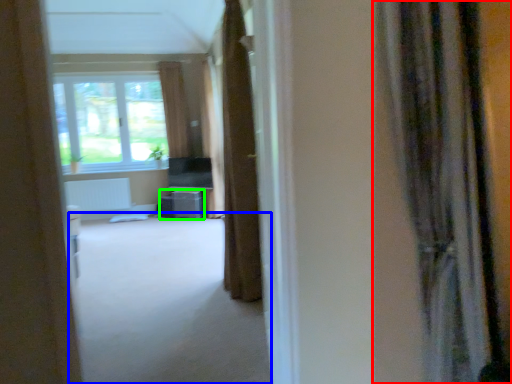
Question: Which object is positioned closest to curtain (highlighted by a red box)? Select from corridor (highlighted by a blue box) and furniture (highlighted by a green box).

Choices:
 (A) corridor
 (B) furniture

Answer: (A)